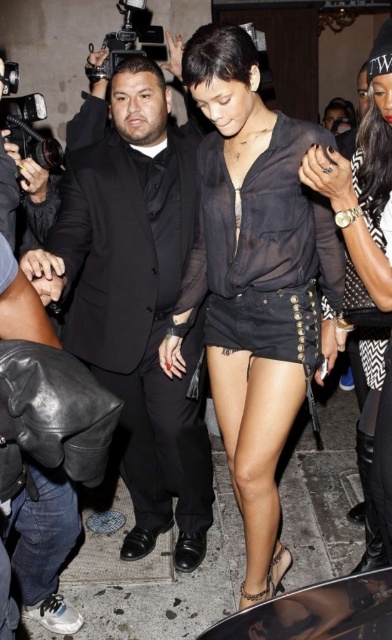
Question: Which point is farther to the camera?

Choices:
 (A) sheer black dress at center
 (B) matte black suit at center
 (C) black sheer blouse at center
 (D) sheer black blouse at center

Answer: (A)

Question: Is sheer black dress at center thinner than black sheer blouse at center?

Choices:
 (A) no
 (B) yes

Answer: (A)

Question: Does matte black suit at center appear on the right side of sheer black dress at center?

Choices:
 (A) no
 (B) yes

Answer: (A)

Question: Which of the following is the closest to the observer?

Choices:
 (A) sheer black dress at center
 (B) black sheer blouse at center
 (C) matte black suit at center
 (D) sheer black blouse at center

Answer: (B)

Question: Is sheer black blouse at center below matte black suit at center?

Choices:
 (A) yes
 (B) no

Answer: (A)

Question: Based on their relative distances, which object is farther from the matte black suit at center?

Choices:
 (A) sheer black blouse at center
 (B) sheer black dress at center
 (C) black sheer blouse at center

Answer: (C)